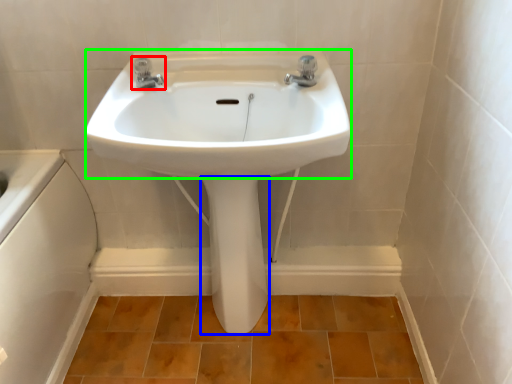
Question: Which object is the closest to the tap (highlighted by a red box)? Choose among these: bidet (highlighted by a blue box) or sink (highlighted by a green box).

Choices:
 (A) bidet
 (B) sink

Answer: (B)